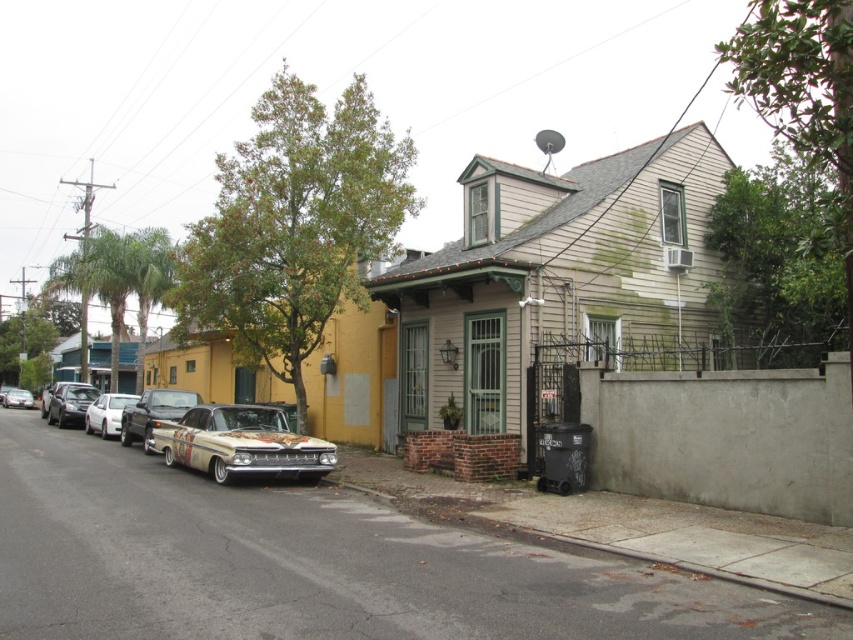
You are standing at the corner of the street and want to take a photo of the point at coordinates [154,412]. Where should you aim your camera to capture this point?

You should aim your camera at the shiny chrome car at center because the point [154,412] is located on it.

Looking at this image, you are a pedestrian standing on the sidewalk in front of the house. You see the shiny chrome car at center and the white matte car at left. Which car is closer to the street?

The shiny chrome car at center is positioned on the right side of white matte car at left, so the white matte car at left is closer to the street.

You are a delivery person trying to park a 10 feet long truck between the shiny chrome car at center and the shiny silver car at left. Can the truck fit in the space between them?

The shiny chrome car at center is 37.90 feet from the shiny silver car at left. Since the truck is only 10 feet long, there is ample space for it to fit between them.